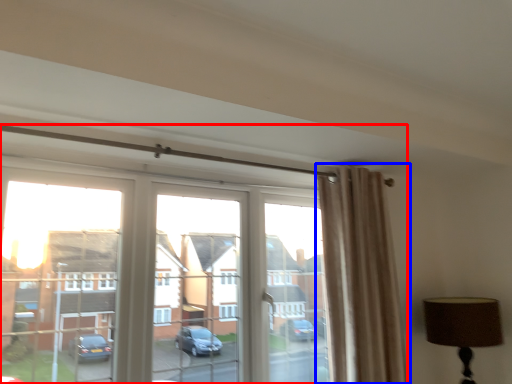
Question: Which object appears closest to the camera in this image, window (highlighted by a red box) or curtain (highlighted by a blue box)?

Choices:
 (A) window
 (B) curtain

Answer: (A)